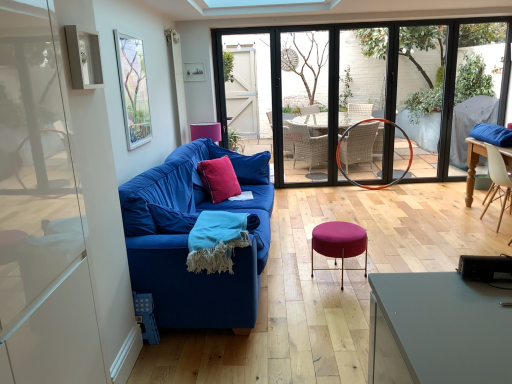
Question: Relative to white wood chair at right, is black plastic speaker at lower right in front or behind?

Choices:
 (A) behind
 (B) front

Answer: (B)

Question: Considering the positions of point pos(466,264) and point pos(496,185), is point pos(466,264) closer or farther from the camera than point pos(496,185)?

Choices:
 (A) farther
 (B) closer

Answer: (B)

Question: Based on their relative distances, which object is nearer to the transparent glass door at center, which is counted as the first glass door, starting from the left?

Choices:
 (A) pink fabric lampshade at center
 (B) blue fabric couch at left
 (C) clear glass window at center
 (D) blue fabric couch at center
 (E) matte glass window screen at upper left

Answer: (D)

Question: Which of these objects is positioned farthest from the blue fabric couch at center?

Choices:
 (A) blue fabric couch at left
 (B) clear glass window at center
 (C) turquoise woven blanket at center
 (D) purple fabric stool at center
 (E) matte glass window screen at upper left

Answer: (C)